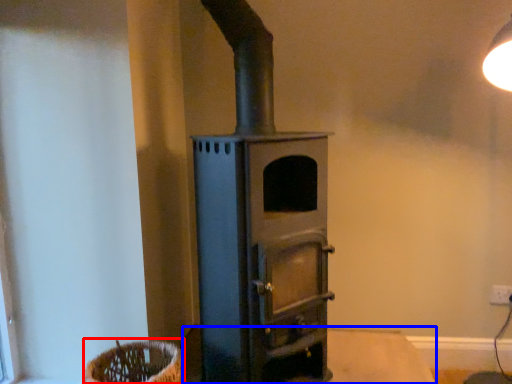
Question: Which object appears farthest to the camera in this image, basket (highlighted by a red box) or table (highlighted by a blue box)?

Choices:
 (A) basket
 (B) table

Answer: (B)